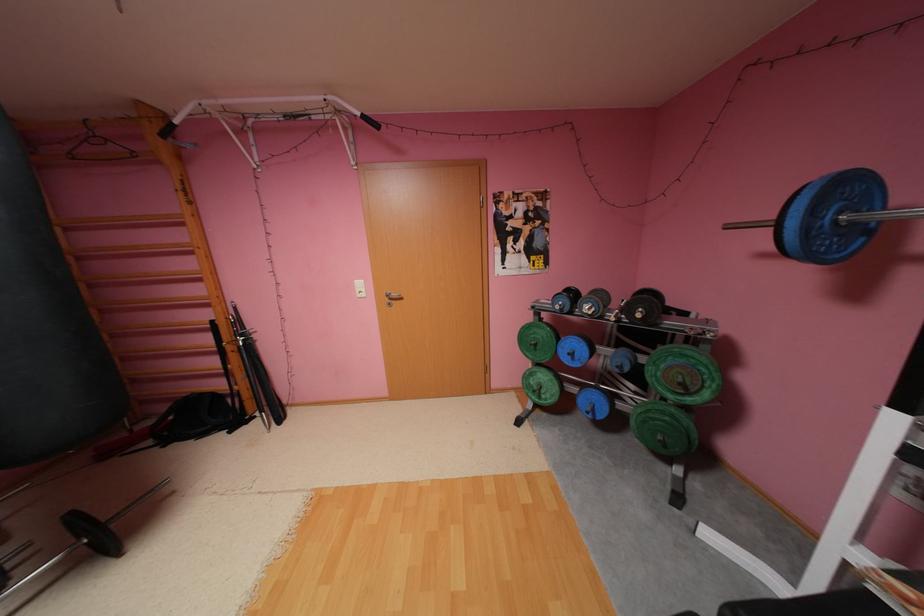
What do you see at coordinates (392, 298) in the screenshot? I see `the silver door handle` at bounding box center [392, 298].